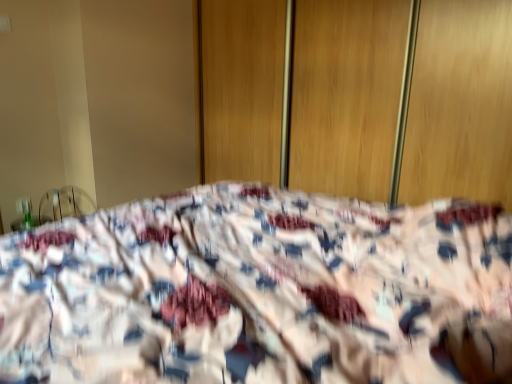
What do you see at coordinates (260, 292) in the screenshot?
I see `fluffy fabric bed at center` at bounding box center [260, 292].

Measure the distance between point (213, 330) and camera.

34.61 inches.

Where is `fluffy fabric bed at center`? This screenshot has width=512, height=384. fluffy fabric bed at center is located at coordinates (260, 292).

The image size is (512, 384). What do you see at coordinates (346, 95) in the screenshot? I see `wooden screen door at center` at bounding box center [346, 95].

In order to face wooden screen door at center, should I rotate leftwards or rightwards?

It's best to rotate right around 8.516 degrees.

The height and width of the screenshot is (384, 512). In order to click on wooden screen door at center in this screenshot , I will do `click(346, 95)`.

This screenshot has height=384, width=512. I want to click on fluffy fabric bed at center, so click(260, 292).

Is wooden screen door at center at the left side of fluffy fabric bed at center?

Incorrect, wooden screen door at center is not on the left side of fluffy fabric bed at center.

Is wooden screen door at center further to the viewer compared to fluffy fabric bed at center?

Yes, wooden screen door at center is behind fluffy fabric bed at center.

Is point (311, 109) farther from viewer compared to point (298, 300)?

Yes, point (311, 109) is behind point (298, 300).

From the image's perspective, between wooden screen door at center and fluffy fabric bed at center, who is located below?

fluffy fabric bed at center appears lower in the image.

From a real-world perspective, who is located higher, wooden screen door at center or fluffy fabric bed at center?

wooden screen door at center.

Considering the sizes of objects wooden screen door at center and fluffy fabric bed at center in the image provided, who is thinner, wooden screen door at center or fluffy fabric bed at center?

wooden screen door at center is thinner.

From their relative heights in the image, would you say wooden screen door at center is taller or shorter than fluffy fabric bed at center?

Clearly, wooden screen door at center is taller compared to fluffy fabric bed at center.

Can you confirm if wooden screen door at center is bigger than fluffy fabric bed at center?

No, wooden screen door at center is not bigger than fluffy fabric bed at center.

Is fluffy fabric bed at center a part of wooden screen door at center?

No, fluffy fabric bed at center is not inside wooden screen door at center.

Is there a large distance between wooden screen door at center and fluffy fabric bed at center?

Absolutely, wooden screen door at center is distant from fluffy fabric bed at center.

Is wooden screen door at center oriented towards fluffy fabric bed at center?

Yes, wooden screen door at center is turned towards fluffy fabric bed at center.

This screenshot has height=384, width=512. Identify the location of screen door located behind the fluffy fabric bed at center. (346, 95).

Between fluffy fabric bed at center and wooden screen door at center, which one appears on the left side from the viewer's perspective?

Positioned to the left is fluffy fabric bed at center.

Who is more distant, fluffy fabric bed at center or wooden screen door at center?

wooden screen door at center.

Considering the positions of points (316, 324) and (379, 184), is point (316, 324) farther from camera compared to point (379, 184)?

No, it is in front of (379, 184).

From the image's perspective, is fluffy fabric bed at center on top of wooden screen door at center?

No, from the image's perspective, fluffy fabric bed at center is not above wooden screen door at center.

From a real-world perspective, which object rests below the other?

fluffy fabric bed at center is physically lower.

Is fluffy fabric bed at center wider or thinner than wooden screen door at center?

In the image, fluffy fabric bed at center appears to be wider than wooden screen door at center.

In the scene shown: Between fluffy fabric bed at center and wooden screen door at center, which one has less height?

fluffy fabric bed at center is shorter.

Considering the sizes of objects fluffy fabric bed at center and wooden screen door at center in the image provided, who is bigger, fluffy fabric bed at center or wooden screen door at center?

Bigger between the two is fluffy fabric bed at center.

From the picture: Is fluffy fabric bed at center positioned beyond the bounds of wooden screen door at center?

Indeed, fluffy fabric bed at center is completely outside wooden screen door at center.

Are fluffy fabric bed at center and wooden screen door at center far apart?

Indeed, fluffy fabric bed at center is not near wooden screen door at center.

Is fluffy fabric bed at center aimed at wooden screen door at center?

No, fluffy fabric bed at center is not facing towards wooden screen door at center.

Consider the image. How different are the orientations of fluffy fabric bed at center and wooden screen door at center in degrees?

The angular difference between fluffy fabric bed at center and wooden screen door at center is 89.9 degrees.

Measure the distance between fluffy fabric bed at center and wooden screen door at center.

fluffy fabric bed at center is 1.08 meters from wooden screen door at center.

Identify the location of bed in front of the wooden screen door at center. The image size is (512, 384). (260, 292).

Locate an element on the screen. Image resolution: width=512 pixels, height=384 pixels. bed on the left of wooden screen door at center is located at coordinates (260, 292).

Locate an element on the screen. bed located underneath the wooden screen door at center (from a real-world perspective) is located at coordinates (260, 292).